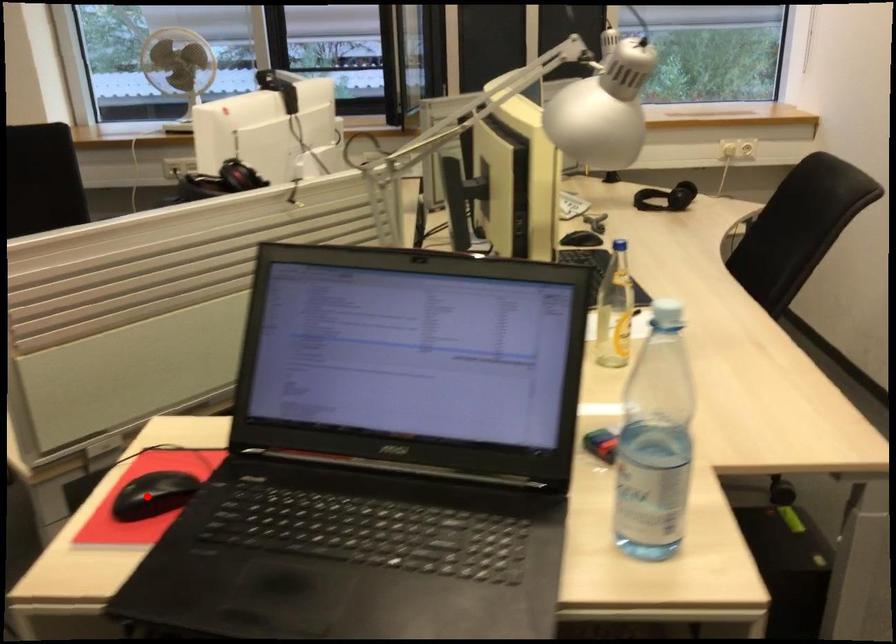
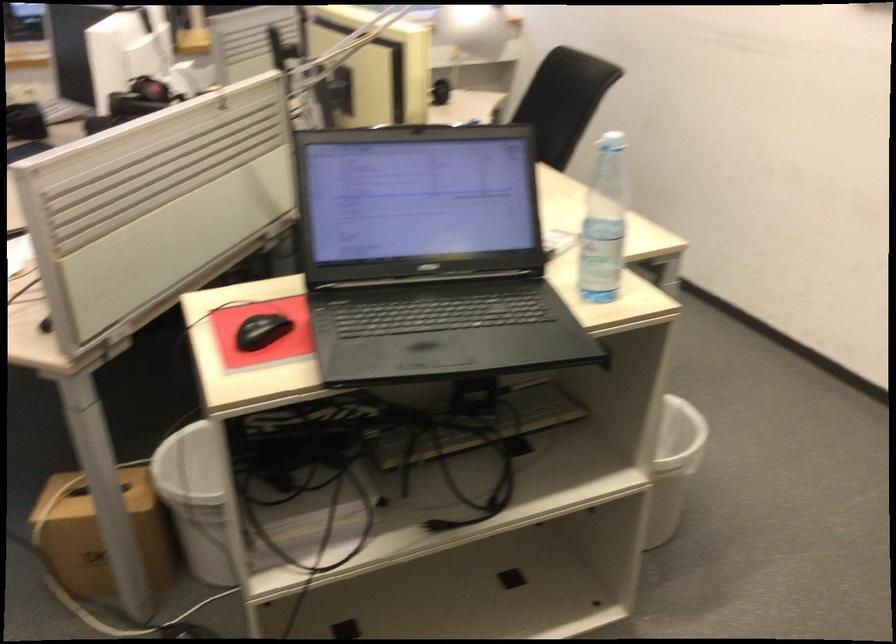
Question: I am providing you with two images of the same scene from different viewpoints. A red point is shown in image1. For the corresponding object point in image2, is it positioned nearer or farther from the camera?

Choices:
 (A) Nearer
 (B) Farther

Answer: (B)